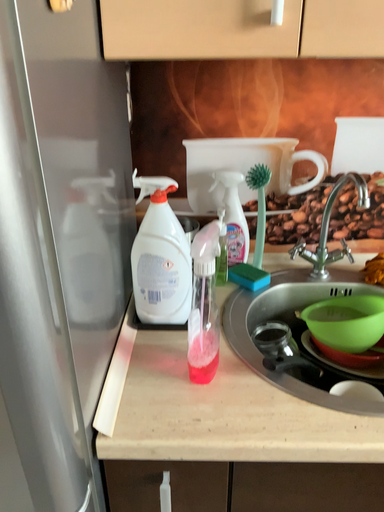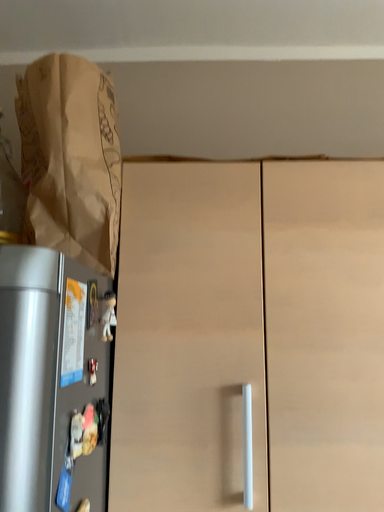
Question: Which way did the camera rotate in the video?

Choices:
 (A) rotated upward
 (B) rotated downward

Answer: (A)